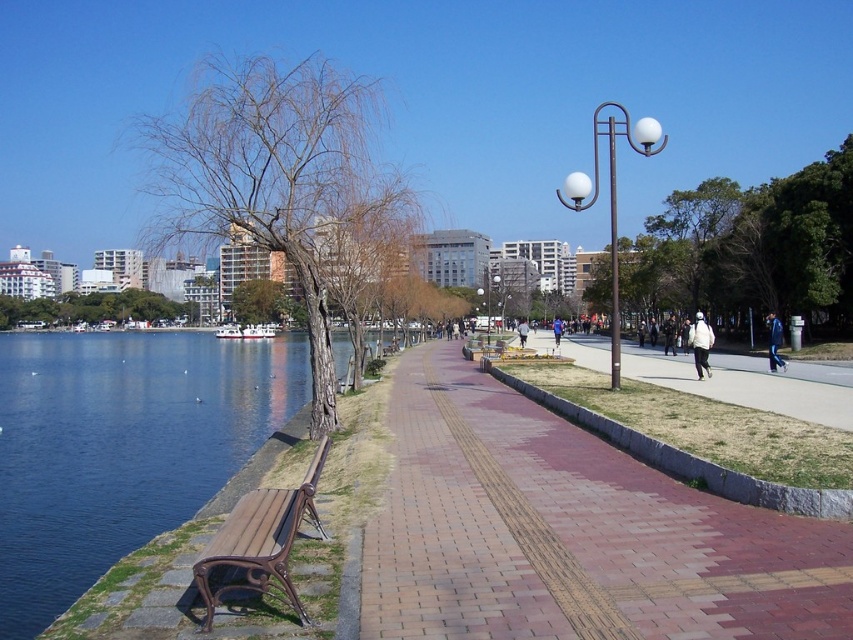
Between green leafy tree at center and brick paved sidewalk at center, which one has less height?

Standing shorter between the two is brick paved sidewalk at center.

Is green leafy tree at center in front of brick paved sidewalk at center?

No, it is not.

Who is more distant from viewer, (787,307) or (671,369)?

The point (787,307) is more distant.

Find the location of a particular element. green leafy tree at center is located at coordinates (750, 250).

Can you confirm if blue fabric jacket at right is positioned above white cotton jacket at center?

Actually, blue fabric jacket at right is below white cotton jacket at center.

Can you confirm if blue fabric jacket at right is shorter than white cotton jacket at center?

Yes.

Describe the element at coordinates (775, 342) in the screenshot. I see `blue fabric jacket at right` at that location.

Find the location of a particular element. This screenshot has height=640, width=853. blue fabric jacket at right is located at coordinates (775, 342).

Is point (701, 364) positioned after point (524, 337)?

No, it is not.

Can you confirm if white matte jacket at center-right is thinner than white cotton jacket at center?

No, white matte jacket at center-right is not thinner than white cotton jacket at center.

Where is `white matte jacket at center-right`? The image size is (853, 640). white matte jacket at center-right is located at coordinates (700, 344).

The width and height of the screenshot is (853, 640). Find the location of `white matte jacket at center-right`. white matte jacket at center-right is located at coordinates (700, 344).